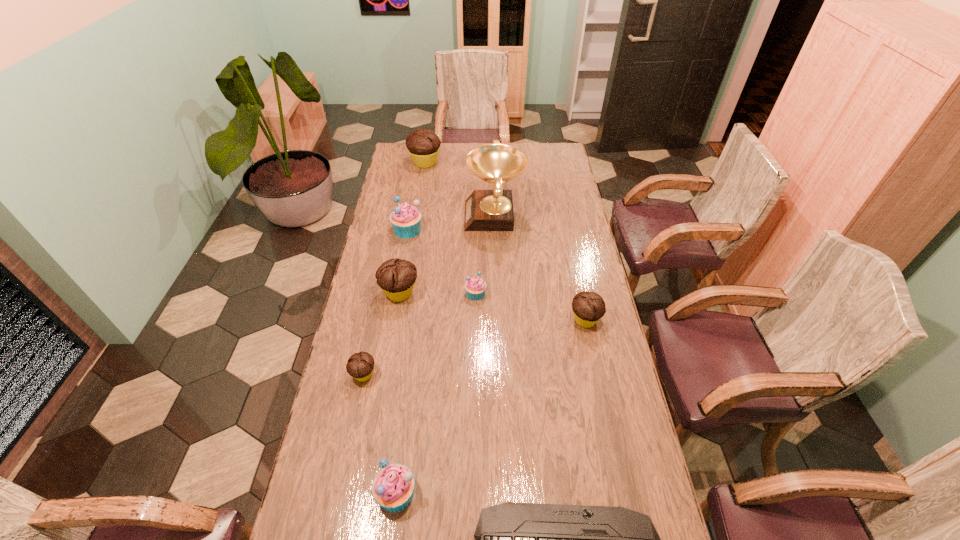
What are the coordinates of `muffin that is the fourth closest one to the shortest object` in the screenshot? It's located at [475, 288].

Locate an element on the screen. The width and height of the screenshot is (960, 540). the second closest chocolate muffin to the third smallest chocolate muffin is located at coordinates (588, 307).

Identify which chocolate muffin is the third closest to the third biggest chocolate muffin. Please provide its 2D coordinates. Your answer should be formatted as a tuple, i.e. [(x, y)], where the tuple contains the x and y coordinates of a point satisfying the conditions above.

[(423, 145)]

Locate an element on the screen. The height and width of the screenshot is (540, 960). the third closest blue muffin relative to the tallest object is located at coordinates (393, 487).

The width and height of the screenshot is (960, 540). Identify the location of blue muffin that is the second nearest to the second nearest blue muffin. (393, 487).

Locate an element on the screen. free location that satisfies the following two spatial constraints: 1. on the front side of the farthest blue muffin; 2. on the left side of the smallest blue muffin is located at coordinates (396, 293).

At what (x,y) coordinates should I click in order to perform the action: click on free location that satisfies the following two spatial constraints: 1. on the front side of the third smallest chocolate muffin; 2. on the right side of the nearest blue muffin. Please return your answer as a coordinate pair (x, y). The width and height of the screenshot is (960, 540). Looking at the image, I should click on 366,493.